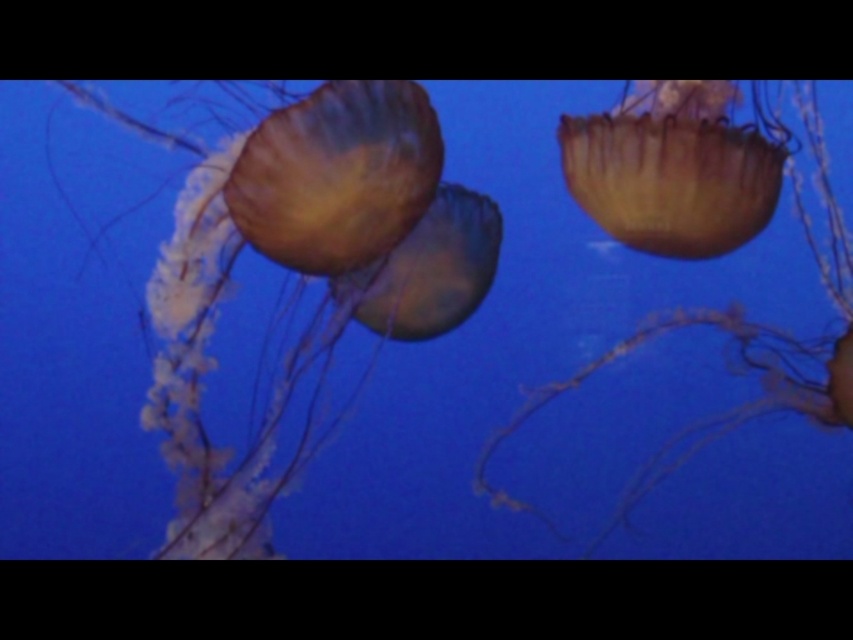
You are a marine biologist observing the jellyfish in the image. You need to determine which object is wider between the translucent gelatinous at left and the translucent yellow jellyfish at center. Can you tell me which one is wider?

The translucent gelatinous at left might be wider than the translucent yellow jellyfish at center according to the description.

You are a marine biologist observing two jellyfish in the image. You see the translucent gelatinous at left and the translucent yellowish jellyfish at center. Which one is located to the right?

The translucent yellowish jellyfish at center is located to the right of the translucent gelatinous at left.